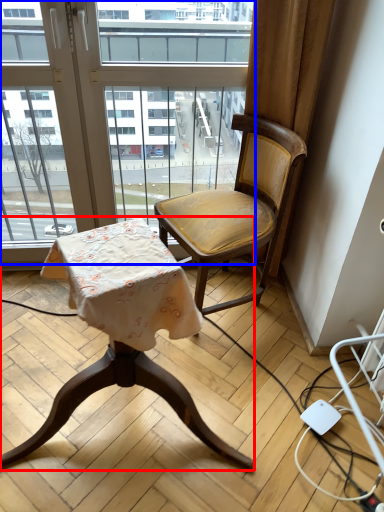
Question: Which object is closer to the camera taking this photo, chair (highlighted by a red box) or window (highlighted by a blue box)?

Choices:
 (A) chair
 (B) window

Answer: (A)